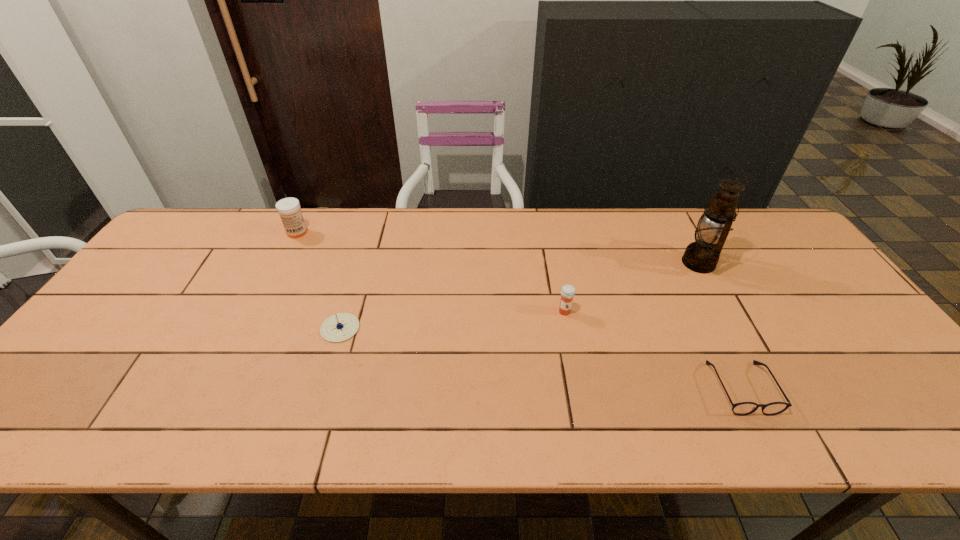
The image size is (960, 540). I want to click on vacant area located 0.240m on the label side of the third tallest object, so click(581, 397).

Identify the location of free space located 0.380m on the back of the second object from left to right. (371, 227).

Locate an element on the screen. The width and height of the screenshot is (960, 540). oil lamp located at the far edge is located at coordinates (702, 256).

The width and height of the screenshot is (960, 540). I want to click on medicine that is at the far edge, so click(289, 210).

At what (x,y) coordinates should I click in order to perform the action: click on object present at the near edge. Please return your answer as a coordinate pair (x, y). This screenshot has height=540, width=960. Looking at the image, I should click on (743, 408).

This screenshot has height=540, width=960. I want to click on free space at the far edge of the desktop, so click(246, 224).

This screenshot has height=540, width=960. In the image, there is a desktop. What are the coordinates of `vacant space at the near edge` in the screenshot? It's located at (284, 403).

Locate an element on the screen. The image size is (960, 540). free location at the left edge of the desktop is located at coordinates (106, 315).

The image size is (960, 540). What are the coordinates of `free space at the far left corner` in the screenshot? It's located at (215, 215).

In the image, there is a desktop. Where is `vacant space at the near right corner`? vacant space at the near right corner is located at coordinates (922, 440).